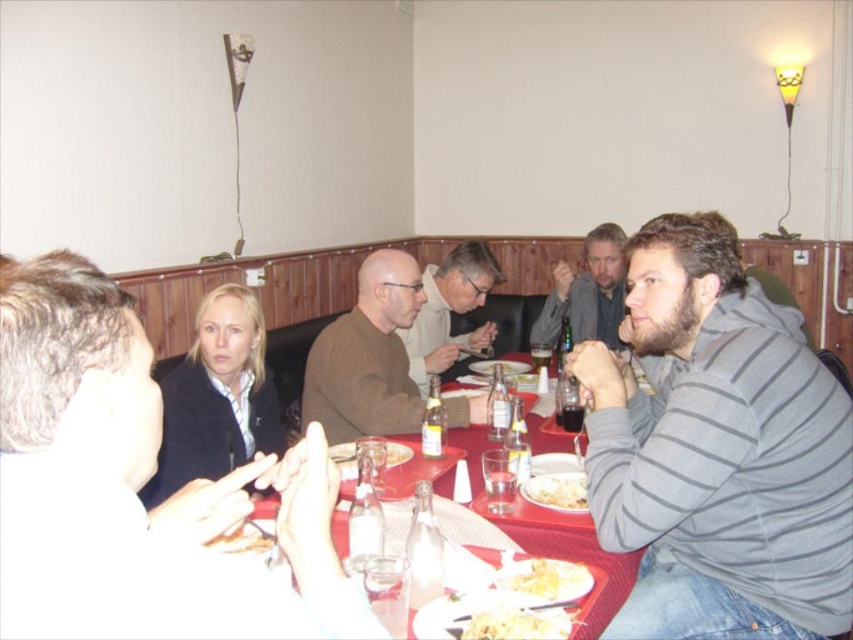
Question: Is brown wool sweater at upper left wider than white paper plate at center?

Choices:
 (A) no
 (B) yes

Answer: (B)

Question: Which of the following is the farthest from the observer?

Choices:
 (A) gray striped hoodie at center
 (B) brown wool sweater at center

Answer: (A)

Question: Which object is farther from the camera taking this photo?

Choices:
 (A) white paper plate at center
 (B) gray striped hoodie at center

Answer: (B)

Question: Is gray striped hoodie at right below yellowish matte pasta at center?

Choices:
 (A) no
 (B) yes

Answer: (A)

Question: Based on their relative distances, which object is farther from the golden crispy bread at center?

Choices:
 (A) gray striped hoodie at center
 (B) matte brown sweater at center
 (C) gray striped hoodie at right
 (D) brown wool sweater at center

Answer: (A)

Question: Is yellowish matte pasta at center above white creamy pasta at center?

Choices:
 (A) no
 (B) yes

Answer: (A)